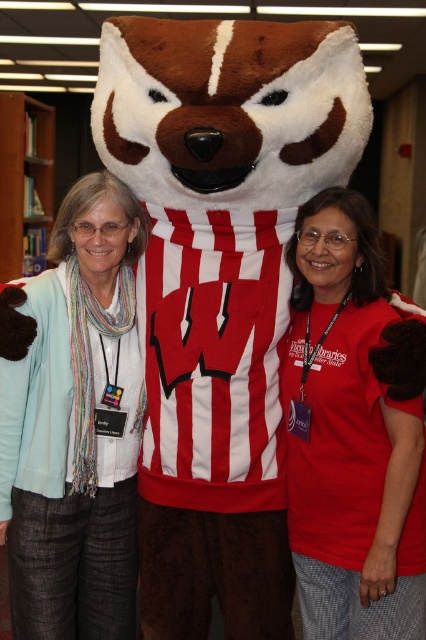
Question: Which is nearer to the matte red shirt at center?

Choices:
 (A) light blue cardigan at left
 (B) wooden bookshelf at left

Answer: (A)

Question: Considering the real-world distances, which object is closest to the matte red shirt at center?

Choices:
 (A) light blue cardigan at left
 (B) wooden bookshelf at left

Answer: (A)

Question: Which point is farther from the camera taking this photo?

Choices:
 (A) (32, 230)
 (B) (69, 516)
 (C) (327, 502)

Answer: (A)

Question: Observing the image, what is the correct spatial positioning of matte red shirt at center in reference to light blue cardigan at left?

Choices:
 (A) right
 (B) left

Answer: (A)

Question: Is matte red shirt at center further to camera compared to wooden bookshelf at left?

Choices:
 (A) no
 (B) yes

Answer: (A)

Question: Does light blue cardigan at left appear on the left side of wooden bookshelf at left?

Choices:
 (A) no
 (B) yes

Answer: (A)